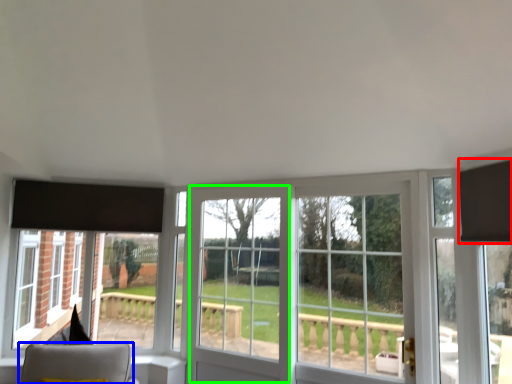
Question: Which is farther away from curtain (highlighted by a red box)? furniture (highlighted by a blue box) or screen door (highlighted by a green box)?

Choices:
 (A) furniture
 (B) screen door

Answer: (A)